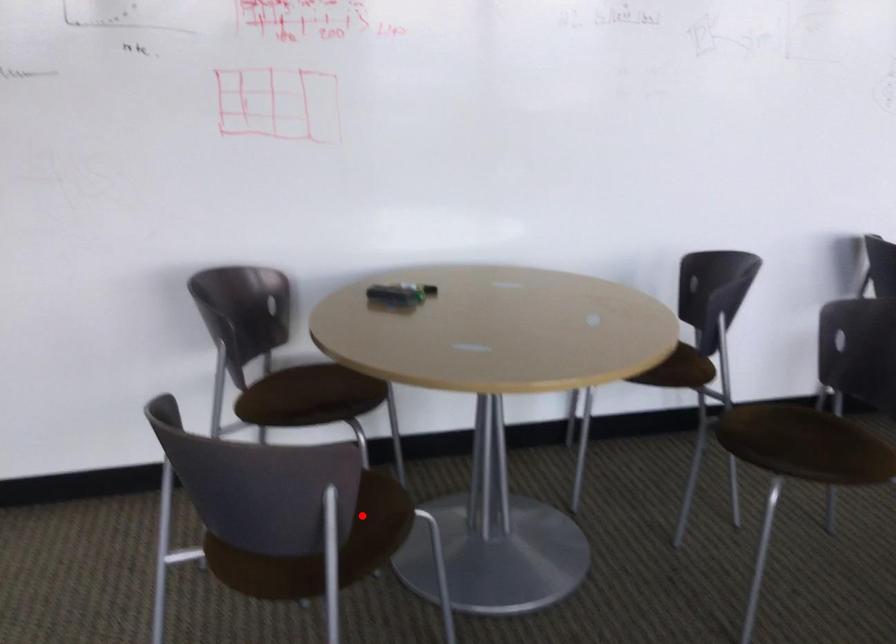
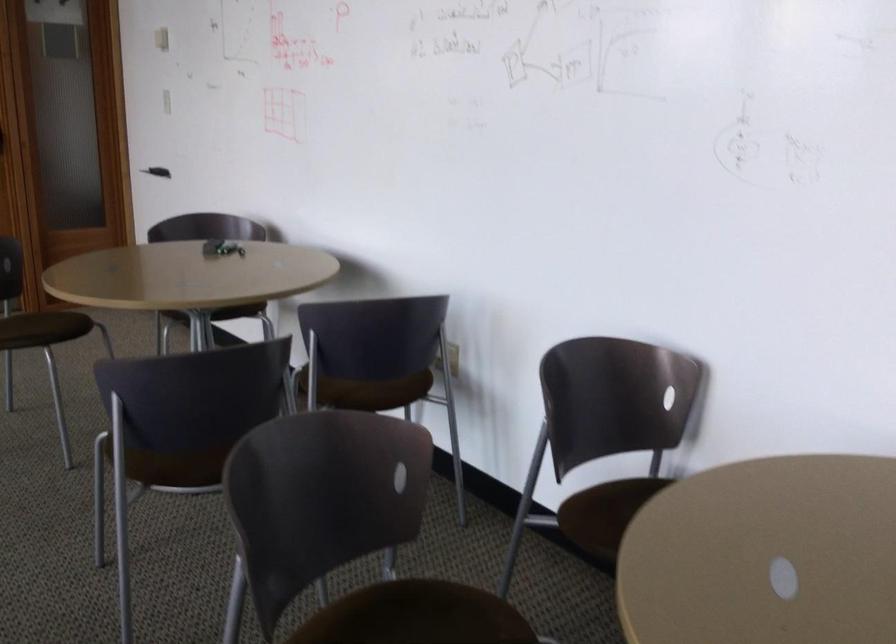
Locate, in the second image, the point that corresponds to the highlighted location in the first image.

(44, 328)